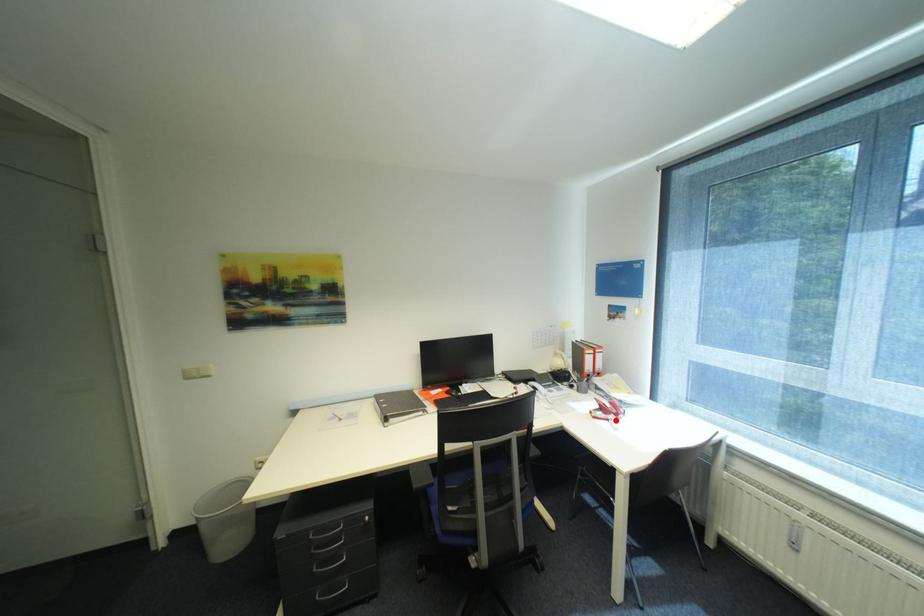
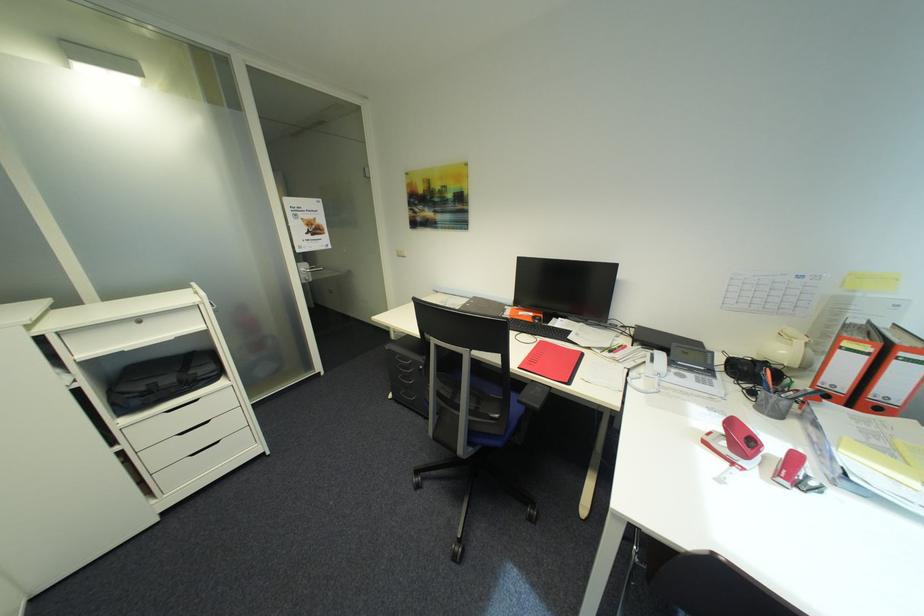
The point at the highlighted location is marked in the first image. Where is the corresponding point in the second image?

(742, 464)